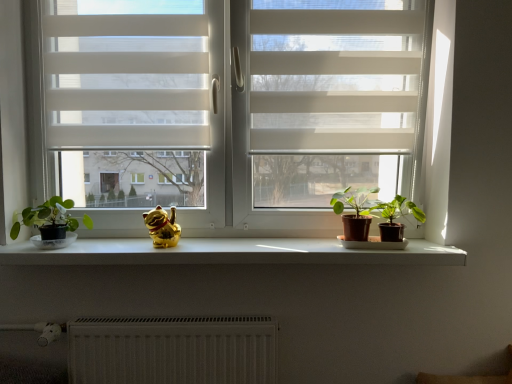
At what (x,y) coordinates should I click in order to perform the action: click on vacant space that's between green matte houseplant at right, acting as the 1th houseplant starting from the right, and white matte window at center. Please return your answer as a coordinate pair (x, y). This screenshot has width=512, height=384. Looking at the image, I should click on (258, 249).